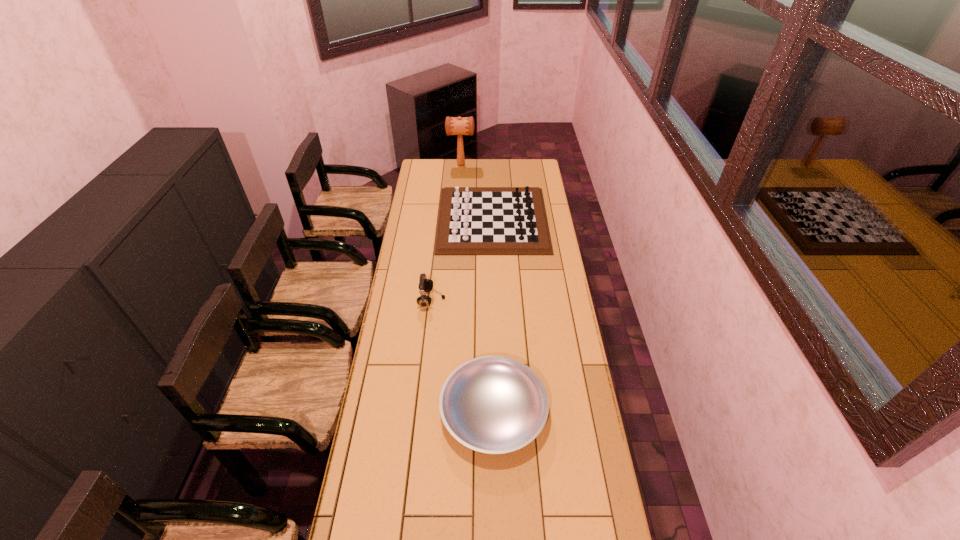
Where is `empty space between the tallest object and the shortest object`? This screenshot has height=540, width=960. empty space between the tallest object and the shortest object is located at coordinates tap(477, 288).

You are a GUI agent. You are given a task and a screenshot of the screen. Output one action in this format:
    pyautogui.click(x=<x>, y=<y>)
    Task: Click on the free space that is in between the headset and the nearest object
    This screenshot has width=960, height=540.
    Given the screenshot: What is the action you would take?
    pyautogui.click(x=463, y=356)

Locate an element on the screen. Image resolution: width=960 pixels, height=540 pixels. vacant space that's between the nearest object and the tallest object is located at coordinates 477,288.

Find the location of a particular element. The image size is (960, 540). blank region between the third shortest object and the third nearest object is located at coordinates (462, 260).

Find the location of `empty space between the nearest object and the mallet`. empty space between the nearest object and the mallet is located at coordinates (477, 288).

This screenshot has height=540, width=960. I want to click on object identified as the closest to the farthest object, so click(472, 220).

At what (x,y) coordinates should I click in order to perform the action: click on the third closest object to the farthest object. Please return your answer as a coordinate pair (x, y). Looking at the image, I should click on (492, 404).

Locate an element on the screen. The width and height of the screenshot is (960, 540). vacant space that satisfies the following two spatial constraints: 1. with the microphone on the side of the headset; 2. on the left side of the shortest object is located at coordinates (420, 411).

You are a GUI agent. You are given a task and a screenshot of the screen. Output one action in this format:
    pyautogui.click(x=<x>, y=<y>)
    Task: Click on the free space that satisfies the following two spatial constraints: 1. with the microphone on the side of the second tallest object; 2. on the right side of the bedpan
    This screenshot has height=540, width=960.
    Given the screenshot: What is the action you would take?
    pyautogui.click(x=420, y=411)

This screenshot has width=960, height=540. What are the coordinates of `free space that satisfies the following two spatial constraints: 1. with the microphone on the side of the second nearest object; 2. on the back side of the shortest object` in the screenshot? It's located at (420, 411).